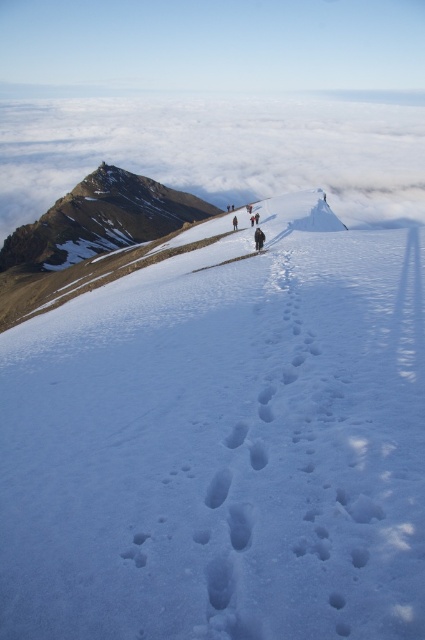
You are planning to take a photo of the dark brown leather jacket at center from the white fluffy cloud at upper center. Is the cloud wider than the jacket?

The white fluffy cloud at upper center might be wider than dark brown leather jacket at center according to the description.

Looking at the mountain landscape, where is the white fluffy cloud at upper center in relation to the snowy rocky peak at upper left?

The white fluffy cloud at upper center is above the snowy rocky peak at upper left.

You are a hiker planning to reach the snowy rocky peak at upper left from your current position near the dark brown leather jacket at center. Given that your average walking pace is 3 km per hour, how long would it take you to reach the peak?

The distance between the snowy rocky peak at upper left and the dark brown leather jacket at center is 205.16 meters. At a walking pace of 3 km per hour, it would take approximately 4 minutes to reach the peak.